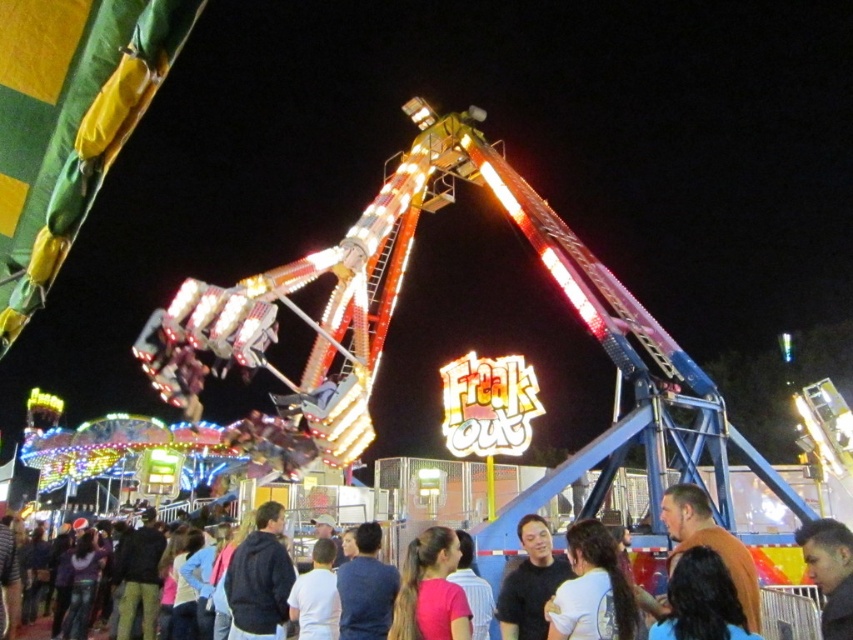
Question: Estimate the real-world distances between objects in this image. Which object is farther from the dark brown hair at center?

Choices:
 (A) blue fabric shirt at lower center
 (B) white matte shirt at center

Answer: (B)

Question: Can you confirm if pink matte shirt at center is thinner than dark brown shirt at center?

Choices:
 (A) yes
 (B) no

Answer: (A)

Question: Does pink matte shirt at center appear on the left side of brown fuzzy sweater at lower right?

Choices:
 (A) no
 (B) yes

Answer: (B)

Question: Which of the following is the farthest from the observer?

Choices:
 (A) dark brown shirt at center
 (B) dark brown hair at center
 (C) black matte jacket at lower left

Answer: (C)

Question: Which point is closer to the camera?

Choices:
 (A) (809, 529)
 (B) (308, 589)

Answer: (A)

Question: Is black matte jacket at lower left thinner than brown fuzzy sweater at lower right?

Choices:
 (A) no
 (B) yes

Answer: (B)